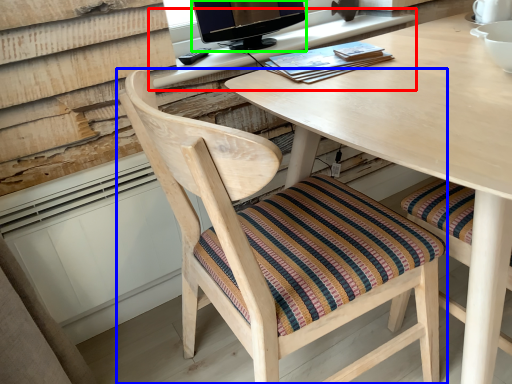
Question: Based on their relative distances, which object is nearer to computer desk (highlighted by a red box)? Choose from chair (highlighted by a blue box) and television (highlighted by a green box).

Choices:
 (A) chair
 (B) television

Answer: (B)